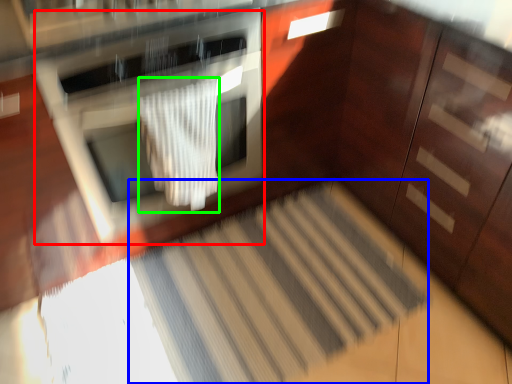
Question: Which object is positioned closest to oven (highlighted by a red box)? Select from stair (highlighted by a blue box) and blanket (highlighted by a green box).

Choices:
 (A) stair
 (B) blanket

Answer: (B)